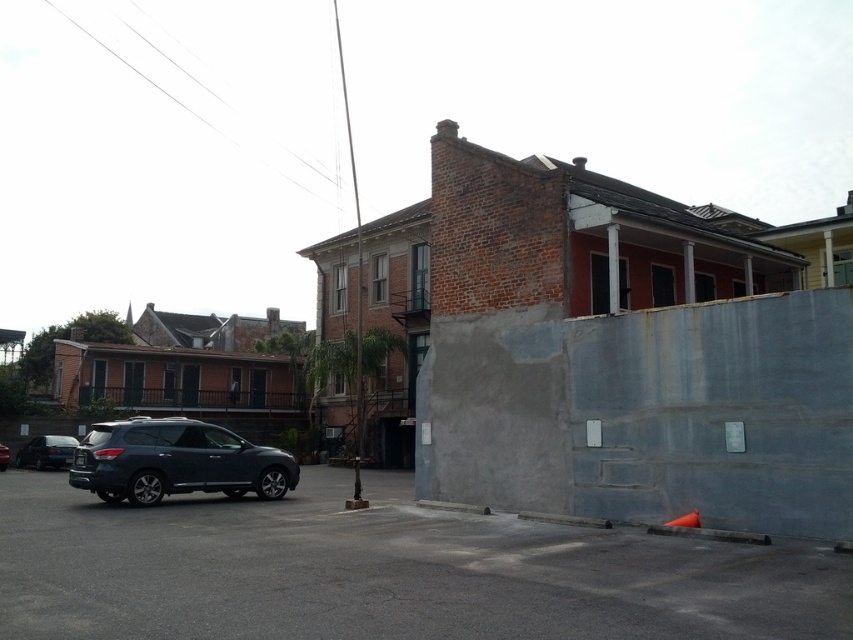
Question: Is satin black sedan at lower left wider than matte black suv at lower left?

Choices:
 (A) yes
 (B) no

Answer: (A)

Question: Which of the following is the closest to the observer?

Choices:
 (A) satin black suv at lower left
 (B) matte black suv at lower left
 (C) satin black sedan at lower left

Answer: (A)

Question: Which point is closer to the camera?

Choices:
 (A) (4, 467)
 (B) (231, 444)
 (C) (45, 460)

Answer: (B)

Question: Where is satin black suv at lower left located in relation to satin black sedan at lower left in the image?

Choices:
 (A) below
 (B) above

Answer: (B)

Question: Is satin black sedan at lower left to the left of matte black suv at lower left from the viewer's perspective?

Choices:
 (A) yes
 (B) no

Answer: (B)

Question: Which point appears farthest from the camera in this image?

Choices:
 (A) (221, 474)
 (B) (49, 438)
 (C) (9, 456)

Answer: (C)